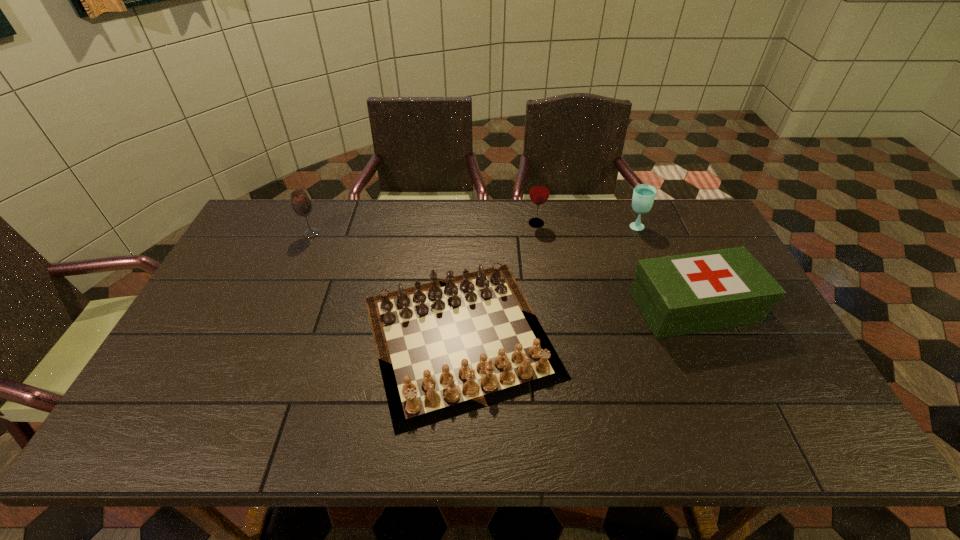
The image size is (960, 540). I want to click on the second glass from left to right, so click(x=539, y=192).

Locate an element on the screen. Image resolution: width=960 pixels, height=540 pixels. the leftmost object is located at coordinates (301, 204).

This screenshot has height=540, width=960. Find the location of `the rightmost glass`. the rightmost glass is located at coordinates (643, 197).

Image resolution: width=960 pixels, height=540 pixels. In order to click on the first-aid kit in this screenshot , I will do `click(682, 294)`.

Where is `chessboard`? This screenshot has height=540, width=960. chessboard is located at coordinates pyautogui.click(x=447, y=345).

This screenshot has height=540, width=960. Find the location of `free space located on the left of the second glass from right to left`. free space located on the left of the second glass from right to left is located at coordinates pos(451,223).

At what (x,y) coordinates should I click in order to perform the action: click on free space located on the right of the leftmost glass. Please return your answer as a coordinate pair (x, y). The height and width of the screenshot is (540, 960). Looking at the image, I should click on (376, 233).

The image size is (960, 540). What are the coordinates of `vacant space located 0.340m on the left of the rightmost glass` in the screenshot? It's located at (525, 226).

Identify the location of vacant area located 0.330m on the back of the first-aid kit. (651, 212).

Where is `free space located on the right of the chessboard`? free space located on the right of the chessboard is located at coordinates (594, 335).